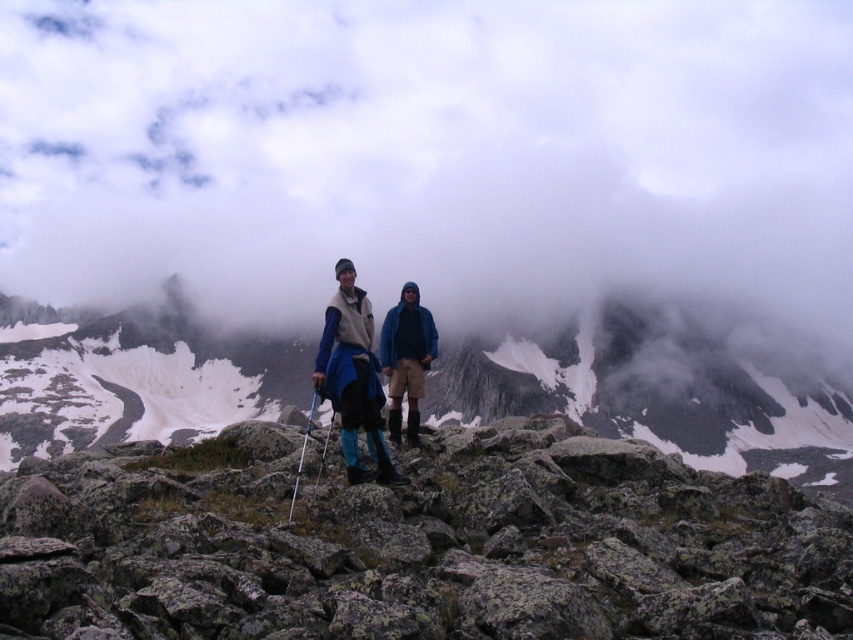
You are a hiker planning to place a small emergency kit between the gray rock at center and the blue fleece jacket at center. Based on their positions, which object should the kit be closer to in order to stay visible and accessible?

The gray rock at center is in front of the blue fleece jacket at center, so placing the emergency kit closer to the gray rock at center would keep it more visible and accessible since it would be nearer to the foreground.

You are a mountain climber assessing the terrain. You notice the gray rock at center and the matte blue jacket at center. Which object is taller?

→ The matte blue jacket at center is taller than the gray rock at center.

You are a hiker trying to navigate the rocky terrain. You see two points marked on your map corresponding to coordinates in the image. The first point is at point (581, 385) and the second is at point (410, 284). Which point is farther away from your current position?

Point (581, 385) is behind point (410, 284), so it is farther away from your current position.